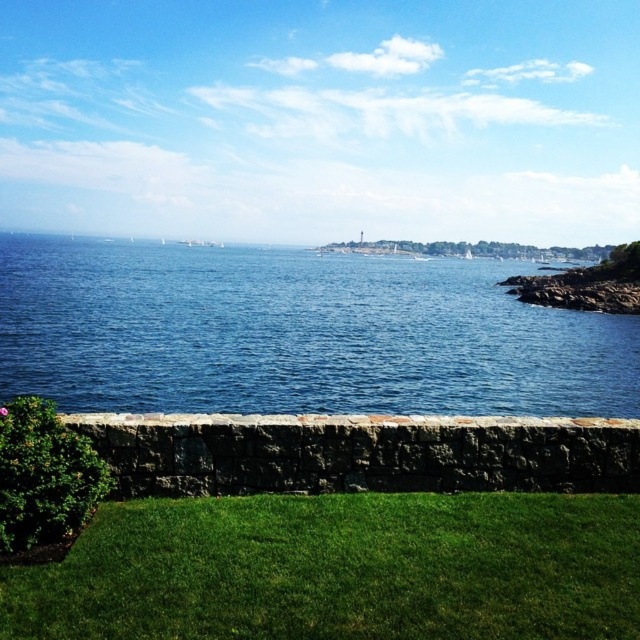
You are standing at the edge of the grassy area looking towards the ocean. There are two points marked in the scene. Which point is closer to you, point (353, 392) or point (291, 608)?

Point (291, 608) is closer to you because it is less further to the camera than point (353, 392).

You are standing at the edge of the grassy area looking towards the ocean. Which object, the green grass at lower center or the blue water at center, is closer to you?

The green grass at lower center is closer to you because it is positioned behind the blue water at center, meaning the blue water is in front of the grass.